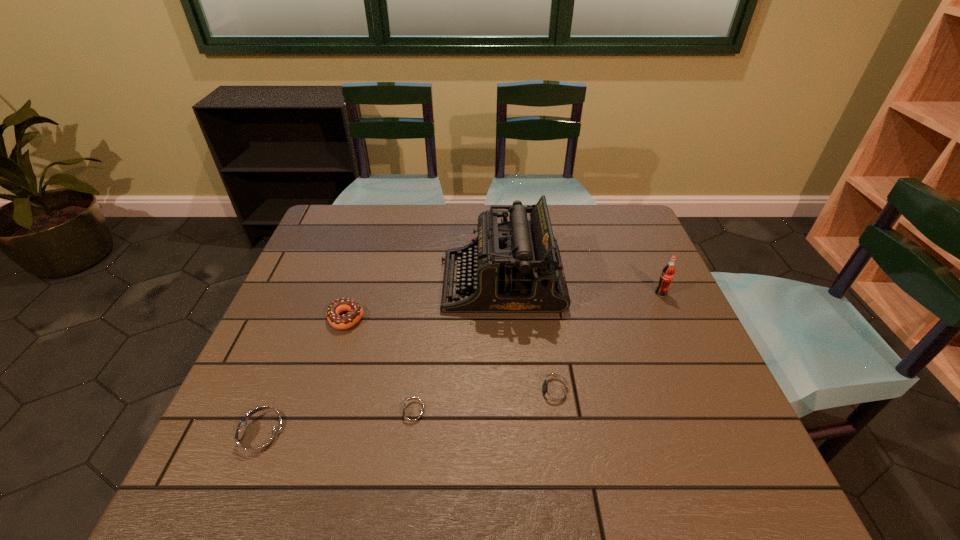
The height and width of the screenshot is (540, 960). Find the location of `blank area located 0.280m on the face of the shortest object`. blank area located 0.280m on the face of the shortest object is located at coordinates point(255,414).

Find the location of a particular element. Image resolution: width=960 pixels, height=540 pixels. vacant position located 0.240m on the face of the shortest object is located at coordinates (275, 414).

Locate an element on the screen. Image resolution: width=960 pixels, height=540 pixels. vacant space located on the face of the rightmost watch is located at coordinates (457, 393).

Locate an element on the screen. The height and width of the screenshot is (540, 960). free space located 0.050m on the face of the rightmost watch is located at coordinates (503, 393).

I want to click on free space located on the face of the rightmost watch, so click(x=471, y=393).

Image resolution: width=960 pixels, height=540 pixels. What are the coordinates of `free spot located on the keyboard of the tallest object` in the screenshot? It's located at (312, 282).

The width and height of the screenshot is (960, 540). In order to click on free region located on the keyboard of the tallest object in this screenshot , I will do `click(394, 282)`.

This screenshot has width=960, height=540. What are the coordinates of `free space located 0.150m on the keyboard of the tallest object` in the screenshot? It's located at (387, 282).

Where is `vacant space located 0.090m on the front of the doughnut`? The height and width of the screenshot is (540, 960). vacant space located 0.090m on the front of the doughnut is located at coordinates (332, 362).

The width and height of the screenshot is (960, 540). What are the coordinates of `free space located 0.320m on the label of the soda bottle` in the screenshot? It's located at (708, 400).